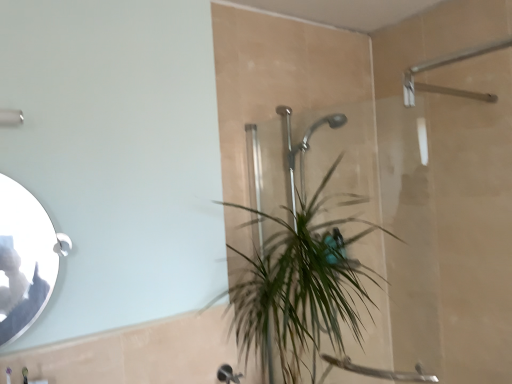
In order to face matte silver shower at upper left, should I rotate leftwards or rightwards?

It's best to rotate left around 37.435 degrees.

This screenshot has width=512, height=384. In order to click on green leafy plant at center in this screenshot , I will do `click(300, 287)`.

Locate an element on the screen. The width and height of the screenshot is (512, 384). silver/metallic mirror at left is located at coordinates (25, 259).

This screenshot has width=512, height=384. In order to click on matte silver shower at upper left in this screenshot , I will do `click(11, 117)`.

Does silver/metallic mirror at left turn towards green leafy plant at center?

No, silver/metallic mirror at left is not facing towards green leafy plant at center.

Is silver/metallic mirror at left inside the boundaries of green leafy plant at center, or outside?

silver/metallic mirror at left is not enclosed by green leafy plant at center.

From the image's perspective, who appears lower, silver/metallic mirror at left or green leafy plant at center?

green leafy plant at center is shown below in the image.

Considering the positions of point (6, 241) and point (345, 264), is point (6, 241) closer or farther from the camera than point (345, 264)?

Point (6, 241) appears to be closer to the viewer than point (345, 264).

Is matte silver shower at upper left thinner than silver/metallic mirror at left?

Yes.

Based on the photo, measure the distance from matte silver shower at upper left to silver/metallic mirror at left.

The distance of matte silver shower at upper left from silver/metallic mirror at left is 13.93 inches.

Is matte silver shower at upper left at the right side of silver/metallic mirror at left?

No, matte silver shower at upper left is not to the right of silver/metallic mirror at left.

Is matte silver shower at upper left behind silver/metallic mirror at left?

No, matte silver shower at upper left is closer to the viewer.

Is matte silver shower at upper left smaller than green leafy plant at center?

Indeed, matte silver shower at upper left has a smaller size compared to green leafy plant at center.

Identify the location of shower in front of the green leafy plant at center. The width and height of the screenshot is (512, 384). (11, 117).

Visually, is matte silver shower at upper left positioned to the left or to the right of green leafy plant at center?

Based on their positions, matte silver shower at upper left is located to the left of green leafy plant at center.

Between matte silver shower at upper left and green leafy plant at center, which one has less height?

With less height is matte silver shower at upper left.

Is point (323, 186) positioned behind point (46, 269)?

Yes, point (323, 186) is behind point (46, 269).

Can you confirm if green leafy plant at center is bigger than silver/metallic mirror at left?

Correct, green leafy plant at center is larger in size than silver/metallic mirror at left.

Between green leafy plant at center and silver/metallic mirror at left, which one is positioned behind?

green leafy plant at center.

Is green leafy plant at center directly adjacent to silver/metallic mirror at left?

They are not placed beside each other.

Who is shorter, silver/metallic mirror at left or matte silver shower at upper left?

With less height is matte silver shower at upper left.

In the scene shown: Relative to matte silver shower at upper left, is silver/metallic mirror at left in front or behind?

silver/metallic mirror at left is behind matte silver shower at upper left.

Which object is thinner, silver/metallic mirror at left or matte silver shower at upper left?

matte silver shower at upper left.

Considering the points (15, 220) and (8, 118), which point is behind, point (15, 220) or point (8, 118)?

Positioned behind is point (8, 118).

Would you say green leafy plant at center is inside or outside matte silver shower at upper left?

The correct answer is: outside.

Is green leafy plant at center at the right side of matte silver shower at upper left?

Yes, green leafy plant at center is to the right of matte silver shower at upper left.

Is green leafy plant at center further to the viewer compared to matte silver shower at upper left?

Yes, it is behind matte silver shower at upper left.

Which of these two, green leafy plant at center or matte silver shower at upper left, is thinner?

Thinner between the two is matte silver shower at upper left.

Where is `houseplant lying on the right of silver/metallic mirror at left`? This screenshot has width=512, height=384. houseplant lying on the right of silver/metallic mirror at left is located at coordinates (300, 287).

What are the coordinates of `shower that is in front of the silver/metallic mirror at left` in the screenshot? It's located at (11, 117).

Looking at the image, which one is located further to green leafy plant at center, matte silver shower at upper left or silver/metallic mirror at left?

matte silver shower at upper left.

Estimate the real-world distances between objects in this image. Which object is closer to green leafy plant at center, silver/metallic mirror at left or matte silver shower at upper left?

Among the two, silver/metallic mirror at left is located nearer to green leafy plant at center.

Estimate the real-world distances between objects in this image. Which object is closer to silver/metallic mirror at left, green leafy plant at center or matte silver shower at upper left?

matte silver shower at upper left is positioned closer to the anchor silver/metallic mirror at left.

From the image, which object appears to be farther from silver/metallic mirror at left, matte silver shower at upper left or green leafy plant at center?

green leafy plant at center is further to silver/metallic mirror at left.

From the picture: Which object lies further to the anchor point matte silver shower at upper left, green leafy plant at center or silver/metallic mirror at left?

green leafy plant at center.

Which object lies nearer to the anchor point matte silver shower at upper left, silver/metallic mirror at left or green leafy plant at center?

The object closer to matte silver shower at upper left is silver/metallic mirror at left.

Locate an element on the screen. mirror between matte silver shower at upper left and green leafy plant at center in the horizontal direction is located at coordinates tap(25, 259).